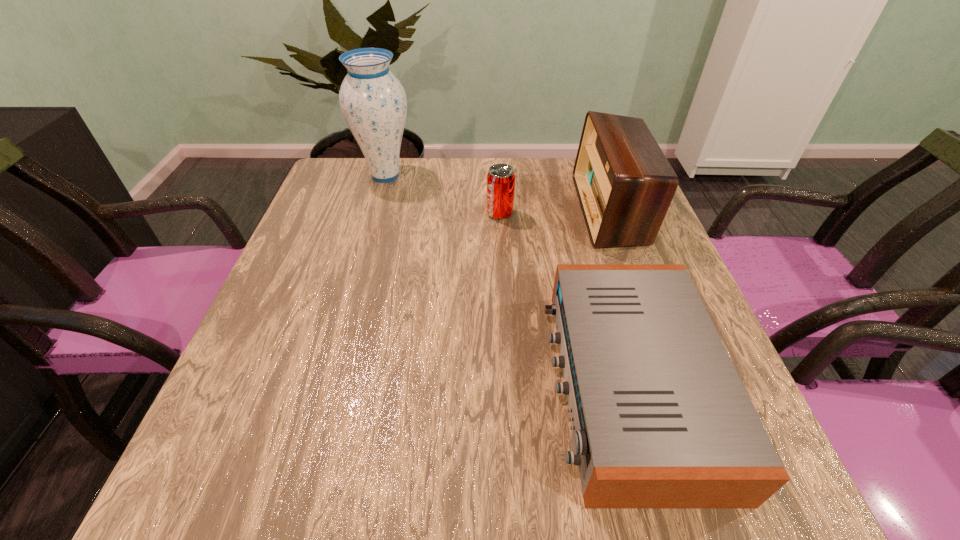
Find the location of `object present at the far left corner`. object present at the far left corner is located at coordinates (373, 102).

Find the location of a particular element. object at the far right corner is located at coordinates (625, 184).

In order to click on object located at the near right corner in this screenshot , I will do (660, 418).

Identify the location of free region at the far edge of the desktop. The height and width of the screenshot is (540, 960). (425, 188).

The height and width of the screenshot is (540, 960). In the image, there is a desktop. Identify the location of vacant space at the near edge. (385, 471).

In the image, there is a desktop. Identify the location of vacant space at the left edge. (327, 248).

Identify the location of vacant space at the right edge of the desktop. (638, 249).

What are the coordinates of `vacant space at the far left corner of the desktop` in the screenshot? It's located at (372, 180).

Identify the location of empty space between the taller radio receiver and the soda can. (555, 212).

Image resolution: width=960 pixels, height=540 pixels. Find the location of `unoccupied position between the tallest object and the shortest object`. unoccupied position between the tallest object and the shortest object is located at coordinates (507, 280).